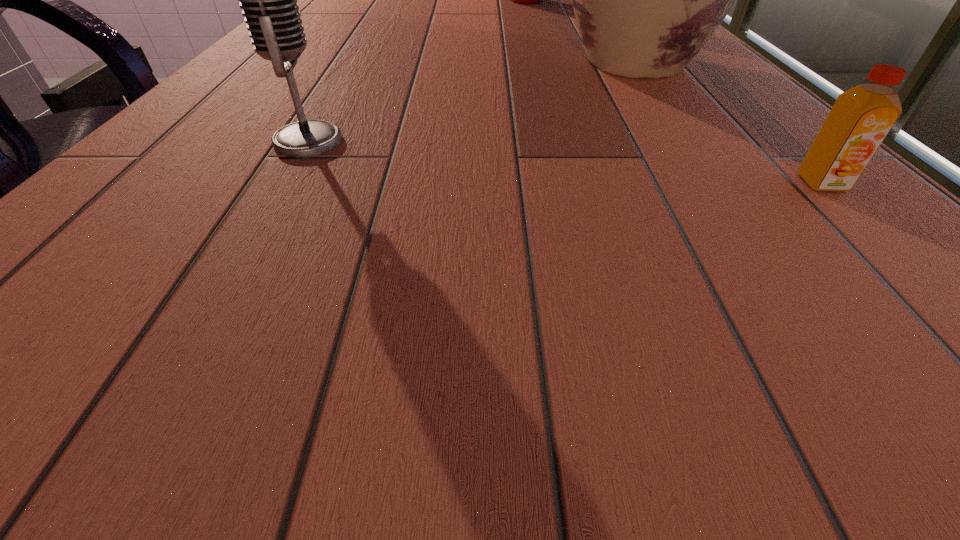
Select which object appears as the second closest to the microphone. Please provide its 2D coordinates. Your answer should be formatted as a tuple, i.e. [(x, y)], where the tuple contains the x and y coordinates of a point satisfying the conditions above.

[(861, 118)]